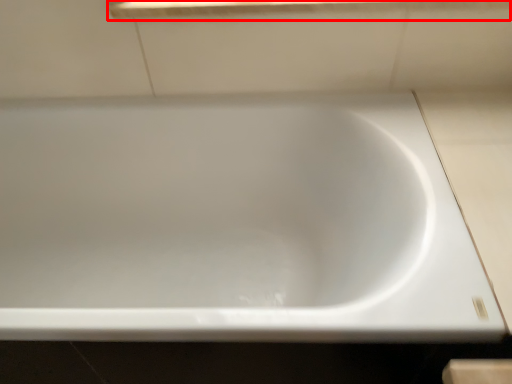
Question: In this image, where is window sill (annotated by the red box) located relative to bathtub?

Choices:
 (A) left
 (B) right

Answer: (B)